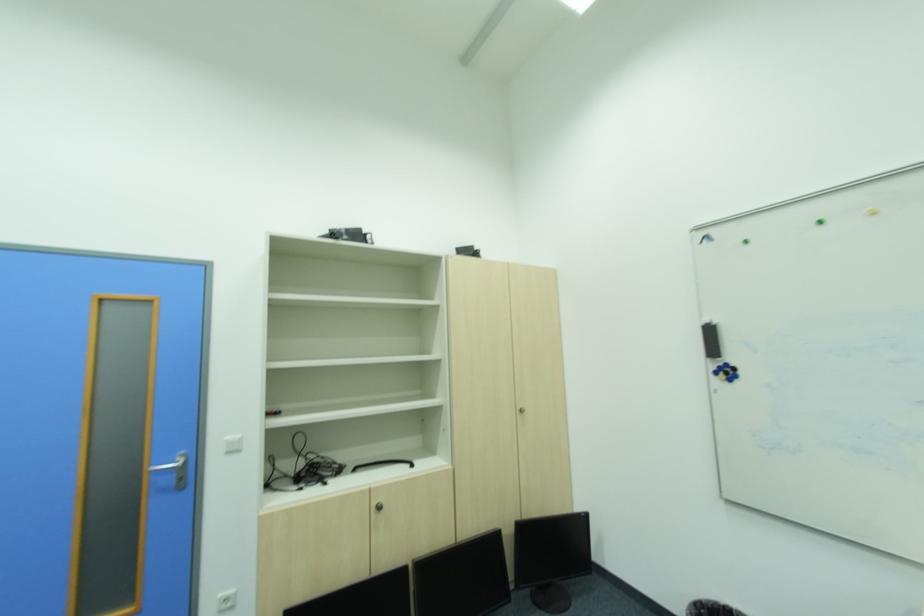
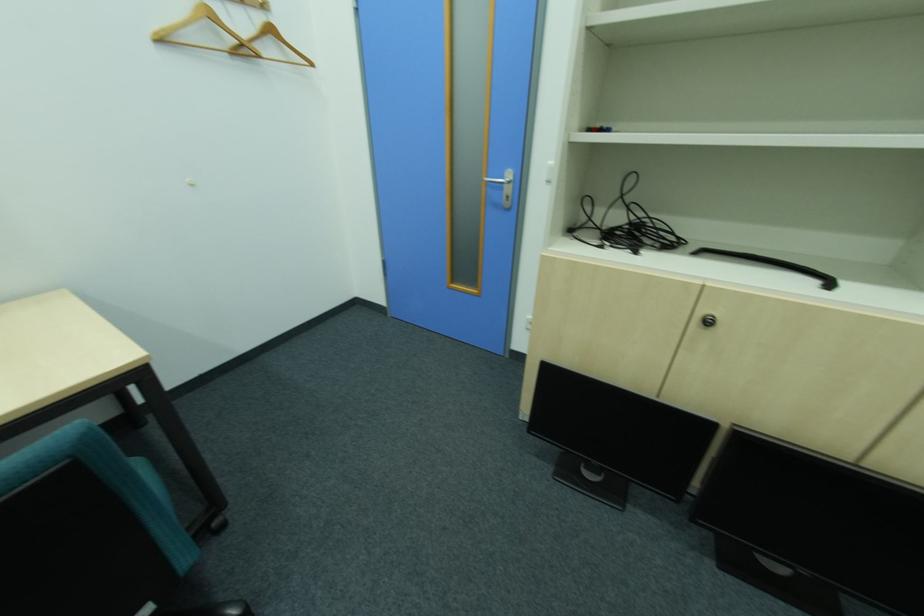
Find the pixel in the second image that matches pixel 186 459 in the first image.

(513, 177)